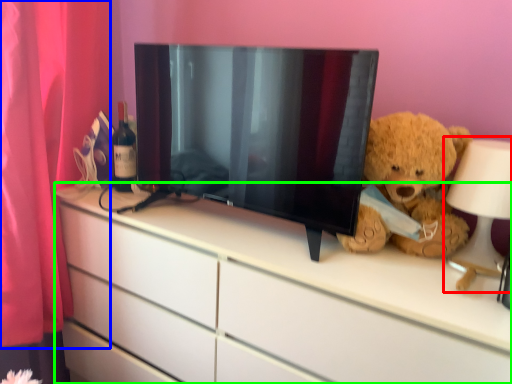
Question: Which object is the farthest from table lamp (highlighted by a red box)? Choose among these: curtain (highlighted by a blue box) or chest of drawers (highlighted by a green box).

Choices:
 (A) curtain
 (B) chest of drawers

Answer: (A)